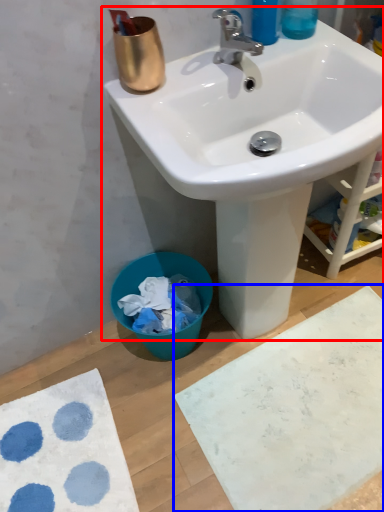
Question: Which object is further to the camera taking this photo, sink (highlighted by a red box) or bath mat (highlighted by a blue box)?

Choices:
 (A) sink
 (B) bath mat

Answer: (B)